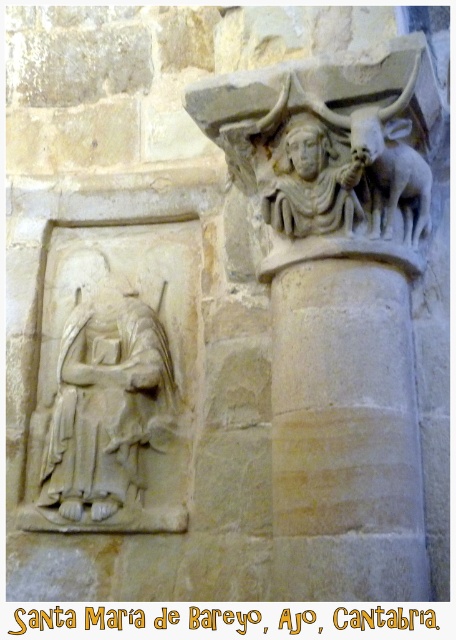
Based on the photo, you are an archaeologist examining the ancient stone wall. You notice two points marked on the wall. The first point is at coordinates point [286,360] and the second at point [112,451]. Which of these points is nearer to your current position as you stand in front of the wall?

Point [286,360] is closer to the viewer than point [112,451], so the first point is nearer to your current position.

From the picture: You are an architect analyzing this ancient structure. You need to determine the central point of the beige stone column at center for a restoration project. What are the coordinates of its center?

The beige stone column at center is located at point coordinates of (345, 435).